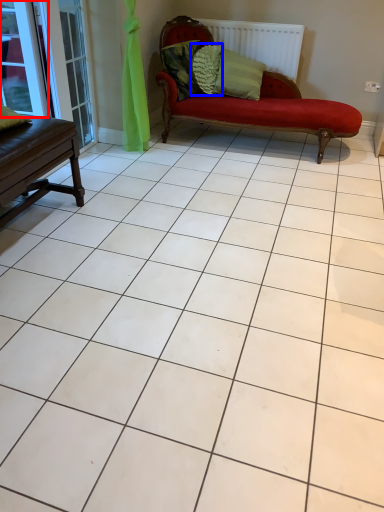
Question: Which object is closer to the camera taking this photo, window (highlighted by a red box) or pillow (highlighted by a blue box)?

Choices:
 (A) window
 (B) pillow

Answer: (A)